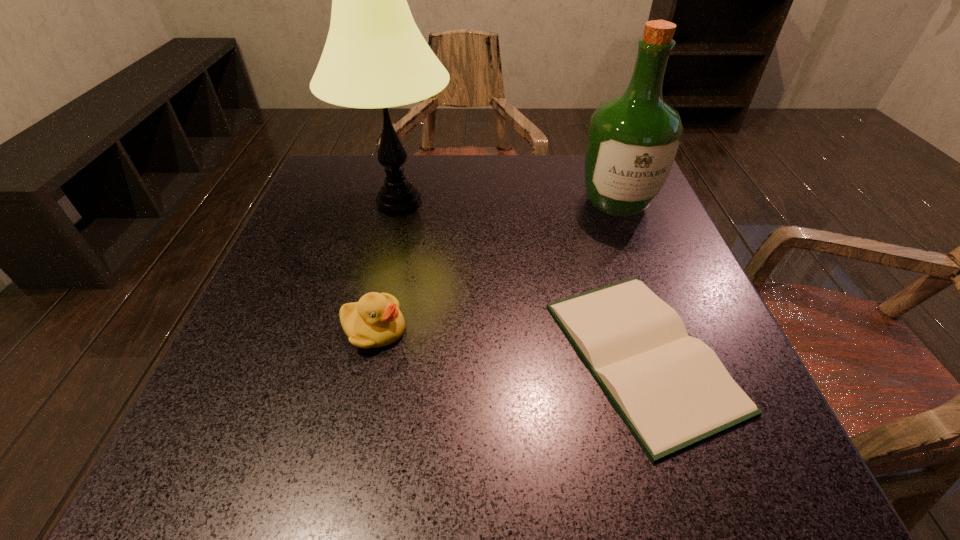
You are a GUI agent. You are given a task and a screenshot of the screen. Output one action in this format:
    pyautogui.click(x=<x>, y=<y>)
    Task: Click on the object located at the near edge
    
    Given the screenshot: What is the action you would take?
    pyautogui.click(x=671, y=389)

Where is `object present at the left edge`? object present at the left edge is located at coordinates (375, 56).

Locate an element on the screen. This screenshot has height=540, width=960. liquor at the right edge is located at coordinates (633, 140).

This screenshot has height=540, width=960. Find the location of `hardback book that is at the right edge`. hardback book that is at the right edge is located at coordinates (671, 389).

This screenshot has height=540, width=960. Identify the location of object present at the far left corner. (375, 56).

Where is `object located in the far right corner section of the desktop`? object located in the far right corner section of the desktop is located at coordinates (633, 140).

This screenshot has width=960, height=540. Find the location of `object present at the near right corner`. object present at the near right corner is located at coordinates (671, 389).

In the image, there is a desktop. Identify the location of vacant space at the far edge. (524, 210).

In the image, there is a desktop. In order to click on free space at the near edge in this screenshot , I will do pyautogui.click(x=377, y=429).

Identify the location of free location at the left edge. The image size is (960, 540). (317, 220).